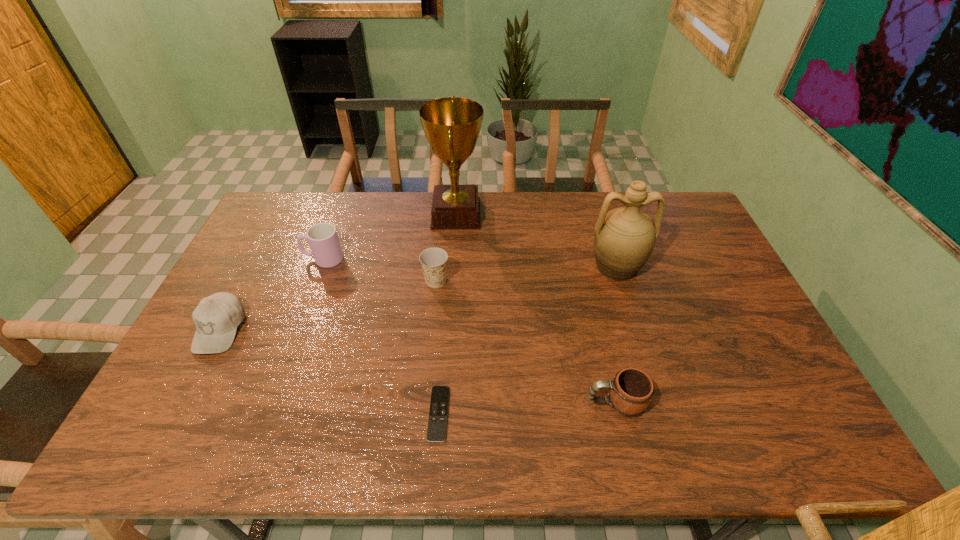
In order to click on free spot located 0.240m on the right of the second tallest object in this screenshot , I will do `click(720, 266)`.

What are the coordinates of `free space located with the handle on the side of the cup` in the screenshot? It's located at (281, 259).

In order to click on vacant area situated with the handle on the side of the cup in this screenshot , I will do `click(278, 259)`.

Locate an element on the screen. vacant space located with the handle on the side of the cup is located at coordinates (254, 259).

Locate an element on the screen. free space located on the back of the Dixie cup is located at coordinates (443, 216).

The image size is (960, 540). Find the location of `free spot located on the front-facing side of the fifth farthest object`. free spot located on the front-facing side of the fifth farthest object is located at coordinates (182, 402).

The height and width of the screenshot is (540, 960). What are the coordinates of `vacant area located on the side of the mug with the handle` in the screenshot? It's located at (512, 402).

Image resolution: width=960 pixels, height=540 pixels. I want to click on vacant region located 0.090m on the side of the mug with the handle, so click(x=549, y=402).

Image resolution: width=960 pixels, height=540 pixels. I want to click on vacant space positioned 0.300m on the side of the mug with the handle, so click(463, 402).

This screenshot has width=960, height=540. I want to click on vacant space situated 0.050m on the back of the remote control, so click(442, 370).